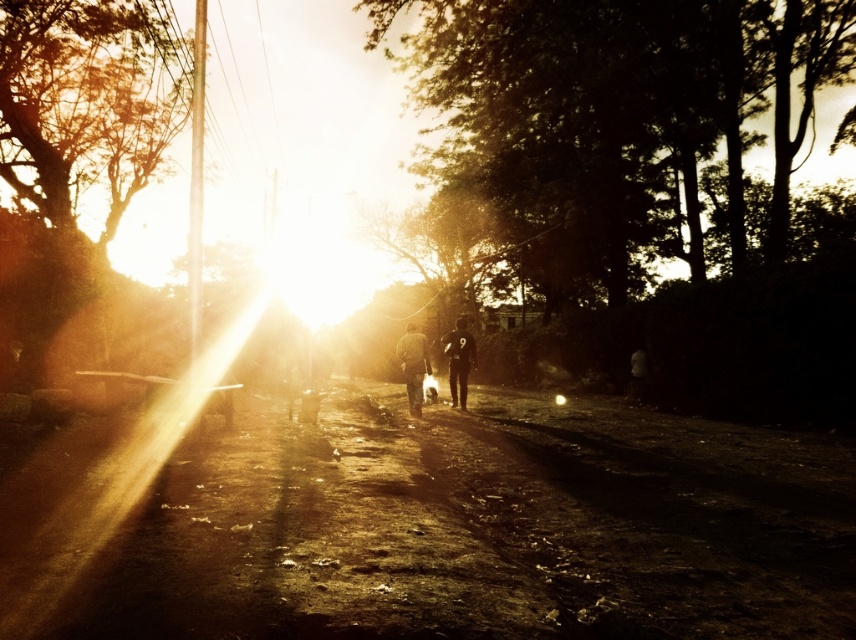
Is the position of silhouetted bark tree at center more distant than that of black matte uniform at center?

No.

Can you confirm if silhouetted bark tree at center is positioned below black matte uniform at center?

Actually, silhouetted bark tree at center is above black matte uniform at center.

Identify the location of silhouetted bark tree at center. This screenshot has width=856, height=640. (613, 125).

What are the coordinates of `silhouetted bark tree at center` in the screenshot? It's located at (613, 125).

Is silhouetted bark tree at center thinner than silhouetted bark tree at left?

In fact, silhouetted bark tree at center might be wider than silhouetted bark tree at left.

Is silhouetted bark tree at center positioned before silhouetted bark tree at left?

No, it is behind silhouetted bark tree at left.

Between point (617, 147) and point (73, 227), which one is positioned in front?

Positioned in front is point (73, 227).

Find the location of `silhouetted bark tree at center`. silhouetted bark tree at center is located at coordinates (613, 125).

Looking at this image, between silhouetted bark tree at left and dark fabric jacket at center, which one appears on the right side from the viewer's perspective?

From the viewer's perspective, dark fabric jacket at center appears more on the right side.

Can you confirm if silhouetted bark tree at left is positioned to the left of dark fabric jacket at center?

Yes, silhouetted bark tree at left is to the left of dark fabric jacket at center.

Is point (90, 61) farther from camera compared to point (415, 342)?

Yes, point (90, 61) is farther from viewer.

Identify the location of silhouetted bark tree at left. The width and height of the screenshot is (856, 640). (85, 116).